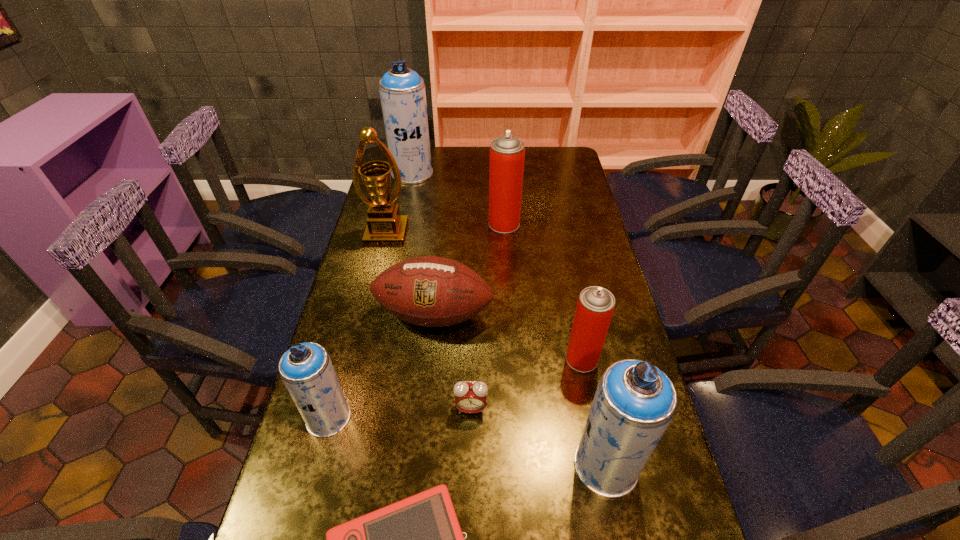
Locate an element on the screen. free space between the award and the rightmost blue aerosol can is located at coordinates (496, 350).

Find the location of a particular element. The width and height of the screenshot is (960, 540). free space between the shortest object and the smallest blue aerosol can is located at coordinates (400, 413).

Point out which object is positioned as the fourth nearest to the second shortest object. Please provide its 2D coordinates. Your answer should be formatted as a tuple, i.e. [(x, y)], where the tuple contains the x and y coordinates of a point satisfying the conditions above.

[(595, 306)]

Locate which object is the closest to the brown football (American). Please provide its 2D coordinates. Your answer should be formatted as a tuple, i.e. [(x, y)], where the tuple contains the x and y coordinates of a point satisfying the conditions above.

[(306, 369)]

Identify the location of the fifth closest aerosol can to the brown football (American). This screenshot has width=960, height=540. (402, 92).

Identify the location of aerosol can object that ranks as the second closest to the second shortest object. (634, 403).

Point out which blue aerosol can is positioned as the third nearest to the award. Please provide its 2D coordinates. Your answer should be formatted as a tuple, i.e. [(x, y)], where the tuple contains the x and y coordinates of a point satisfying the conditions above.

[(634, 403)]

Select which blue aerosol can is the third closest to the left red aerosol can. Please provide its 2D coordinates. Your answer should be formatted as a tuple, i.e. [(x, y)], where the tuple contains the x and y coordinates of a point satisfying the conditions above.

[(634, 403)]

At what (x,y) coordinates should I click in order to perform the action: click on vacant space that satisfies the following two spatial constraints: 1. on the back side of the third shortest object; 2. on the right side of the smallest blue aerosol can. Please return your answer as a coordinate pair (x, y). Looking at the image, I should click on (356, 315).

The width and height of the screenshot is (960, 540). Identify the location of free space that satisfies the following two spatial constraints: 1. on the back side of the right red aerosol can; 2. on the left side of the smallest blue aerosol can. (344, 359).